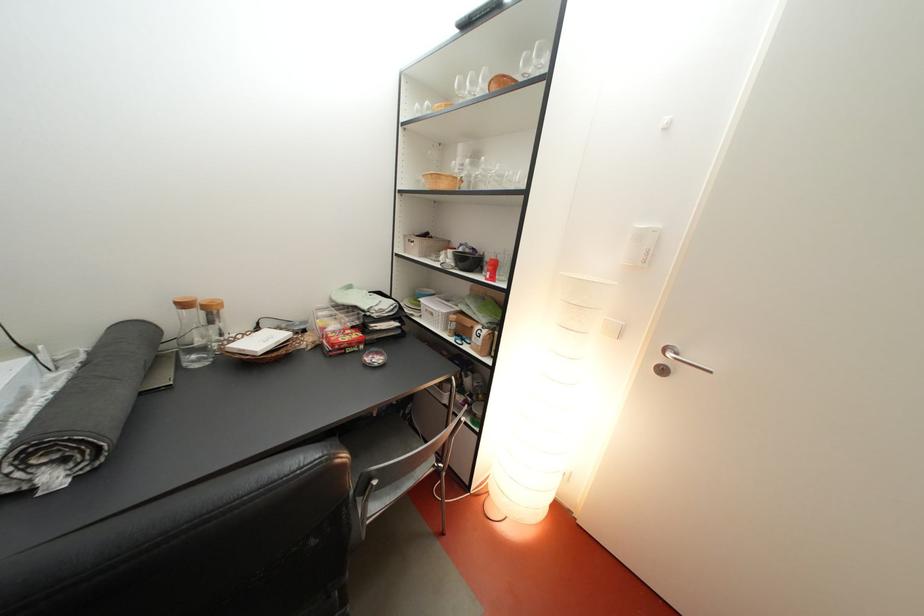
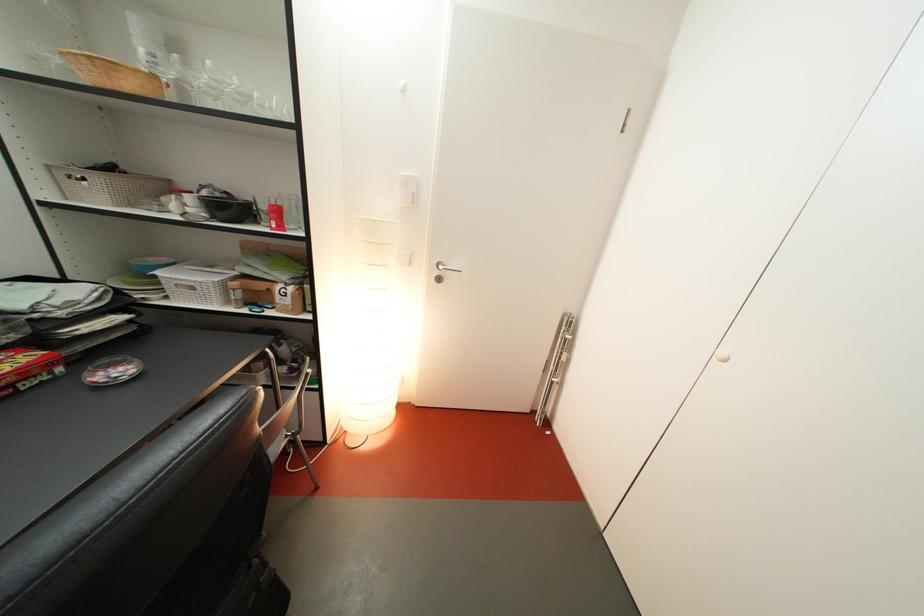
In the second image, find the point that corresponds to (x=439, y=294) in the first image.

(161, 262)